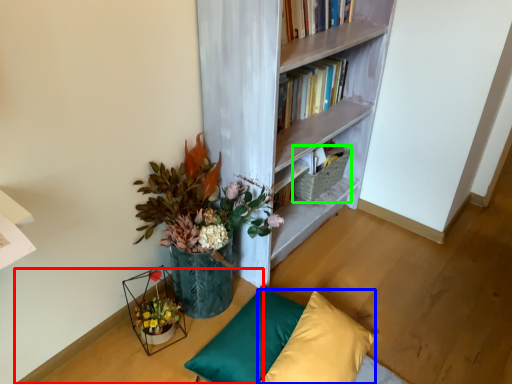
Question: Based on their relative distances, which object is nearer to table (highlighted by a red box)? Choose from pillow (highlighted by a blue box) and basket (highlighted by a green box).

Choices:
 (A) pillow
 (B) basket

Answer: (A)